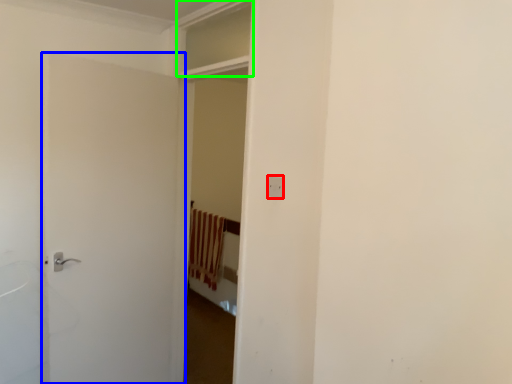
Question: Estimate the real-world distances between objects in this image. Which object is closer to electric outlet (highlighted by a red box), door (highlighted by a blue box) or window (highlighted by a green box)?

Choices:
 (A) door
 (B) window

Answer: (B)